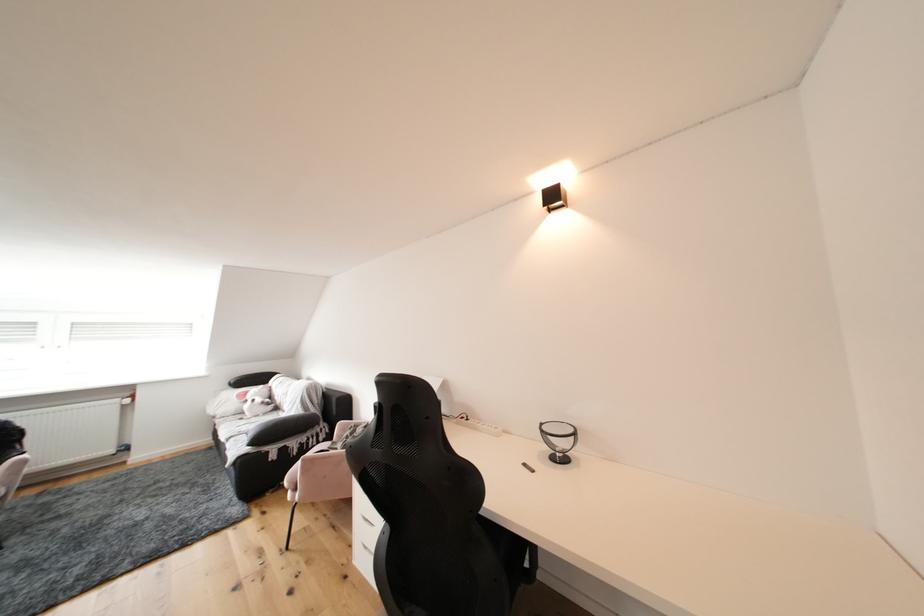
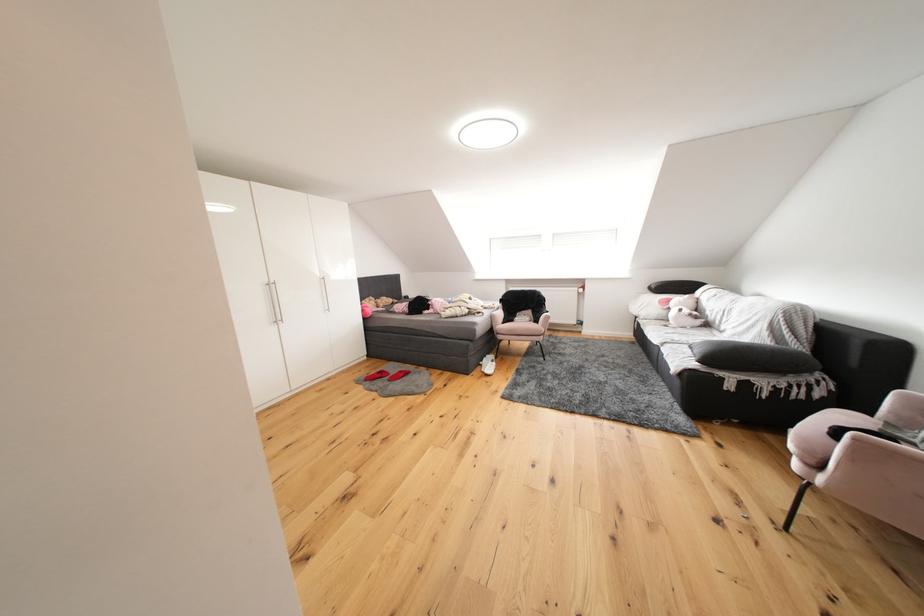
Find the pixel in the second image that matches (256,397) in the first image.

(677, 305)